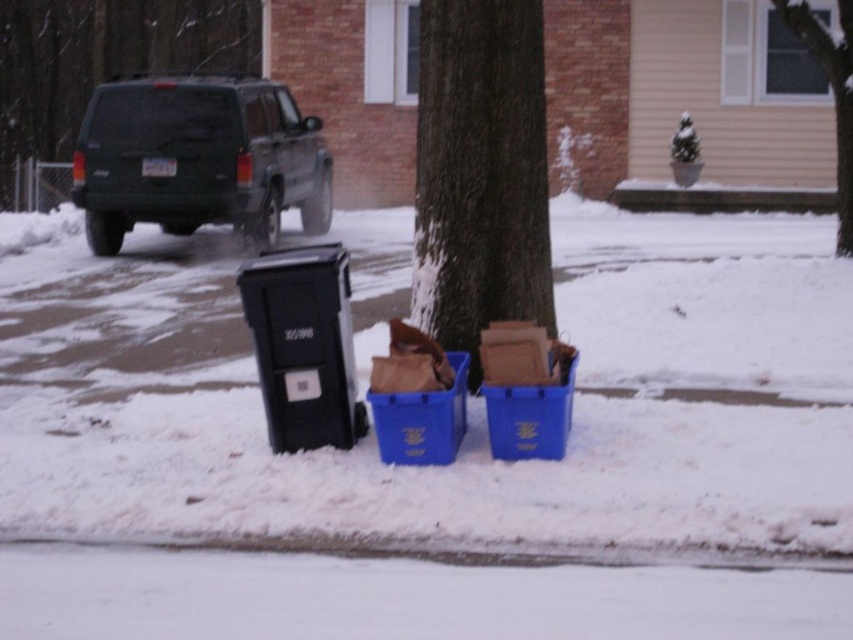
Does dark green matte suv at upper left have a greater height compared to brown paper bag at lower center?

Indeed, dark green matte suv at upper left has a greater height compared to brown paper bag at lower center.

Is dark green matte suv at upper left to the right of brown paper bag at lower center from the viewer's perspective?

No, dark green matte suv at upper left is not to the right of brown paper bag at lower center.

Locate an element on the screen. The height and width of the screenshot is (640, 853). dark green matte suv at upper left is located at coordinates (196, 157).

The height and width of the screenshot is (640, 853). I want to click on dark green matte suv at upper left, so click(x=196, y=157).

Can you confirm if snowy concrete pavement at lower center is bigger than brown rough bark at center?

Yes.

Can you confirm if snowy concrete pavement at lower center is smaller than brown rough bark at center?

No, snowy concrete pavement at lower center is not smaller than brown rough bark at center.

Find the location of a particular element. The height and width of the screenshot is (640, 853). snowy concrete pavement at lower center is located at coordinates (431, 467).

Who is higher up, brown rough bark at center or dark green matte suv at upper left?

dark green matte suv at upper left is higher up.

Measure the distance between point (x=518, y=304) and camera.

Point (x=518, y=304) is 8.16 meters from camera.

The image size is (853, 640). What are the coordinates of `brown rough bark at center` in the screenshot? It's located at (480, 172).